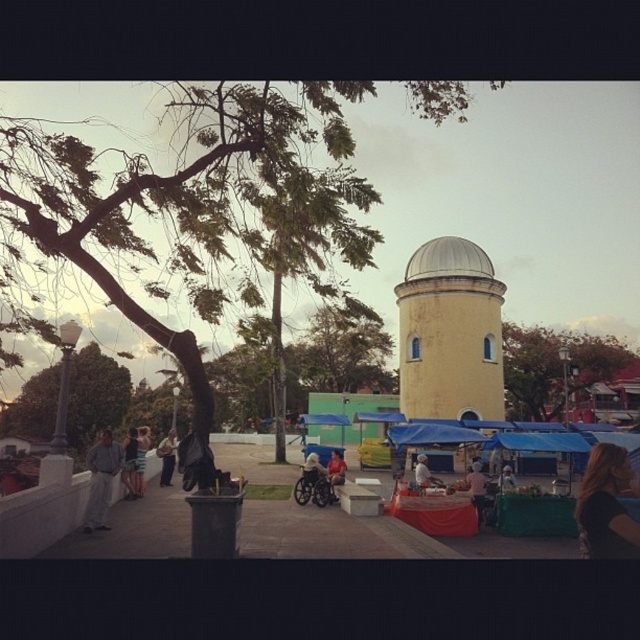
Between green leafy tree at upper left and green leafy tree at left, which one appears on the left side from the viewer's perspective?

From the viewer's perspective, green leafy tree at left appears more on the left side.

Between point (253, 294) and point (129, 392), which one is positioned in front?

Point (253, 294) is more forward.

Image resolution: width=640 pixels, height=640 pixels. Identify the location of green leafy tree at upper left. (196, 205).

Is yellow matte tower at center bigger than orange leafy tree at right?

Incorrect, yellow matte tower at center is not larger than orange leafy tree at right.

Between point (444, 246) and point (545, 337), which one is positioned in front?

Point (444, 246) is in front.

You are a GUI agent. You are given a task and a screenshot of the screen. Output one action in this format:
    pyautogui.click(x=<x>, y=<y>)
    Task: Click on the yellow matte tower at center
    
    Given the screenshot: What is the action you would take?
    pyautogui.click(x=451, y=332)

Can you confirm if blue tarpaulin at center is positioned above light brown leather jacket at center?

Indeed, blue tarpaulin at center is positioned over light brown leather jacket at center.

Does point (582, 436) come closer to viewer compared to point (508, 481)?

No, it is not.

Which is in front, point (572, 438) or point (509, 484)?

Positioned in front is point (572, 438).

Find the location of a particular element. This screenshot has width=640, height=640. blue tarpaulin at center is located at coordinates (540, 442).